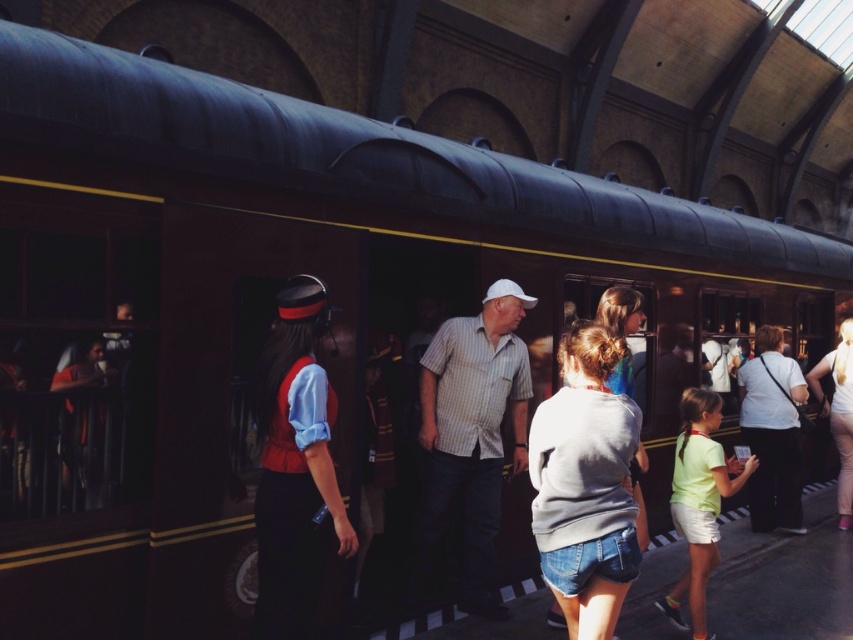
Can you confirm if white cotton shirt at center is smaller than light green fabric shirt at center?

Actually, white cotton shirt at center might be larger than light green fabric shirt at center.

Measure the distance between white cotton shirt at center and camera.

The distance of white cotton shirt at center from camera is 21.30 feet.

Locate an element on the screen. This screenshot has height=640, width=853. white cotton shirt at center is located at coordinates (772, 433).

Does white cotton shirt at center come behind white cotton shirt at lower right?

No, it is in front of white cotton shirt at lower right.

Between white cotton shirt at center and white cotton shirt at lower right, which one is positioned higher?

white cotton shirt at center

Does point (770, 365) come behind point (833, 358)?

That is False.

Locate an element on the screen. white cotton shirt at center is located at coordinates (772, 433).

Can you confirm if light green fabric shirt at center is taller than white cotton shirt at lower right?

Result: In fact, light green fabric shirt at center may be shorter than white cotton shirt at lower right.

Does light green fabric shirt at center have a smaller size compared to white cotton shirt at lower right?

Yes.

Find the location of a particular element. This screenshot has height=640, width=853. light green fabric shirt at center is located at coordinates (699, 500).